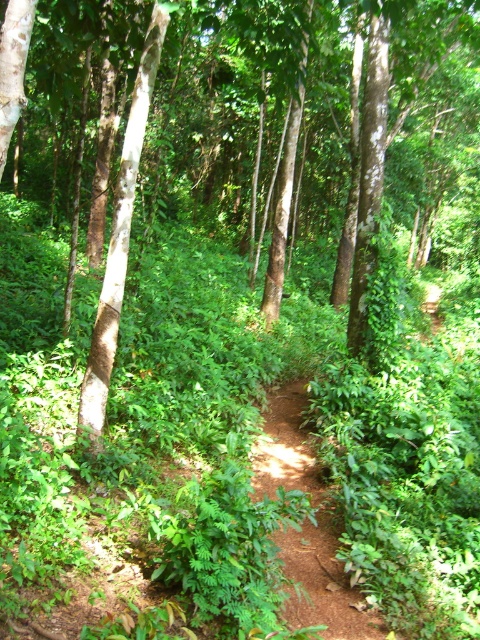
Consider the image. You are a hiker walking along the brown dirt path at center. You notice a brown smooth tree at center in your line of sight. Which direction should you turn to face the tree?

The brown smooth tree at center is to the left of the brown dirt path at center, so you should turn to your left to face the tree.

You are a hiker trying to navigate through the forest. You see the brown smooth tree at center and the brown dirt path at center. Which one is bigger in size?

The brown smooth tree at center has a larger size compared to the brown dirt path at center.

You are a hiker walking along the narrow dirt path in the forest. You notice a brown smooth tree at center and a brown dirt path at center. Which one is higher in elevation?

The brown smooth tree at center is located above the brown dirt path at center, so the tree is higher in elevation.